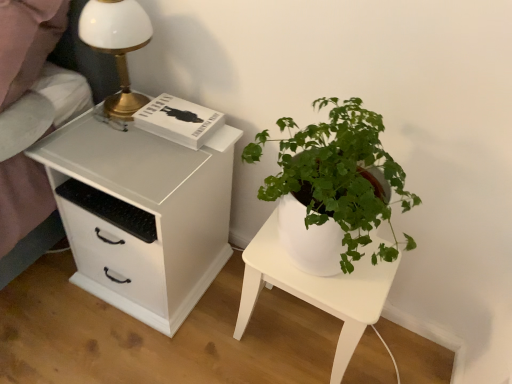
Image resolution: width=512 pixels, height=384 pixels. What do you see at coordinates (316, 289) in the screenshot?
I see `white glossy nightstand at lower right` at bounding box center [316, 289].

Where is `white matte chest of drawers at left`? The image size is (512, 384). white matte chest of drawers at left is located at coordinates pyautogui.click(x=142, y=214).

Between white matte chest of drawers at left and white glossy table lamp at upper left, which one appears on the left side from the viewer's perspective?

From the viewer's perspective, white glossy table lamp at upper left appears more on the left side.

From a real-world perspective, is white matte chest of drawers at left on top of white glossy table lamp at upper left?

No.

Does white matte chest of drawers at left have a greater height compared to white glossy table lamp at upper left?

Yes.

Considering the relative sizes of white matte chest of drawers at left and white glossy table lamp at upper left in the image provided, is white matte chest of drawers at left bigger than white glossy table lamp at upper left?

Yes.

Considering their positions, is white glossy table lamp at upper left located in front of or behind white matte chest of drawers at left?

In the image, white glossy table lamp at upper left appears behind white matte chest of drawers at left.

Considering the positions of objects white glossy table lamp at upper left and white matte chest of drawers at left in the image provided, who is more to the right, white glossy table lamp at upper left or white matte chest of drawers at left?

Positioned to the right is white matte chest of drawers at left.

Is white glossy table lamp at upper left outside of white matte chest of drawers at left?

white glossy table lamp at upper left lies outside white matte chest of drawers at left's area.

Which is further, (97, 39) or (57, 170)?

Positioned behind is point (57, 170).

From a real-world perspective, is white glossy table lamp at upper left over white glossy nightstand at lower right?

Correct, in the physical world, white glossy table lamp at upper left is higher than white glossy nightstand at lower right.

Is white glossy table lamp at upper left facing towards white glossy nightstand at lower right?

No, white glossy table lamp at upper left is not aimed at white glossy nightstand at lower right.

From the image's perspective, which object appears higher, white glossy table lamp at upper left or white glossy nightstand at lower right?

white glossy table lamp at upper left appears higher in the image.

Does white glossy table lamp at upper left have a larger size compared to white glossy nightstand at lower right?

No.

Measure the distance between white glossy nightstand at lower right and white glossy table lamp at upper left.

They are 27.82 inches apart.

In the scene shown: Considering their positions, is white glossy nightstand at lower right located in front of or behind white glossy table lamp at upper left?

Visually, white glossy nightstand at lower right is located behind white glossy table lamp at upper left.

Is white glossy nightstand at lower right next to white glossy table lamp at upper left?

No, white glossy nightstand at lower right is not with white glossy table lamp at upper left.

Which is in front, point (352, 351) or point (106, 30)?

The point (106, 30) is closer to the camera.

Can you confirm if white glossy nightstand at lower right is smaller than white matte chest of drawers at left?

Indeed, white glossy nightstand at lower right has a smaller size compared to white matte chest of drawers at left.

Would you say white glossy nightstand at lower right is to the left or to the right of white matte chest of drawers at left in the picture?

Based on their positions, white glossy nightstand at lower right is located to the right of white matte chest of drawers at left.

In the scene shown: Are white glossy nightstand at lower right and white matte chest of drawers at left located far from each other?

No, white glossy nightstand at lower right is not far away from white matte chest of drawers at left.

Consider the image. Is white glossy nightstand at lower right facing towards white matte chest of drawers at left?

No.

Is white matte chest of drawers at left positioned with its back to white glossy nightstand at lower right?

white matte chest of drawers at left is not turned away from white glossy nightstand at lower right.

What's the angular difference between white matte chest of drawers at left and white glossy nightstand at lower right's facing directions?

white matte chest of drawers at left and white glossy nightstand at lower right are facing 2.68 degrees away from each other.

Does point (167, 321) lie behind point (358, 270)?

Yes, point (167, 321) is farther from viewer.

Considering the relative sizes of white matte chest of drawers at left and white glossy nightstand at lower right in the image provided, is white matte chest of drawers at left thinner than white glossy nightstand at lower right?

Incorrect, the width of white matte chest of drawers at left is not less than that of white glossy nightstand at lower right.

At what (x,y) coordinates should I click in order to perform the action: click on the chest of drawers that is in front of the white glossy table lamp at upper left. Please return your answer as a coordinate pair (x, y). The image size is (512, 384). Looking at the image, I should click on (142, 214).

Identify the location of chest of drawers below the white glossy table lamp at upper left (from the image's perspective). Image resolution: width=512 pixels, height=384 pixels. (142, 214).

Based on their spatial positions, is white matte chest of drawers at left or white glossy nightstand at lower right closer to white glossy table lamp at upper left?

white matte chest of drawers at left lies closer to white glossy table lamp at upper left than the other object.

From the image, which object appears to be farther from white glossy table lamp at upper left, white glossy nightstand at lower right or white matte chest of drawers at left?

white glossy nightstand at lower right is further to white glossy table lamp at upper left.

Considering their positions, is white glossy table lamp at upper left positioned further to white glossy nightstand at lower right than white matte chest of drawers at left?

Based on the image, white glossy table lamp at upper left appears to be further to white glossy nightstand at lower right.

When comparing their distances from white matte chest of drawers at left, does white glossy nightstand at lower right or white glossy table lamp at upper left seem closer?

The object closer to white matte chest of drawers at left is white glossy table lamp at upper left.

From the image, which object appears to be nearer to white matte chest of drawers at left, white glossy table lamp at upper left or white glossy nightstand at lower right?

Based on the image, white glossy table lamp at upper left appears to be nearer to white matte chest of drawers at left.

Which object lies nearer to the anchor point white glossy nightstand at lower right, white matte chest of drawers at left or white glossy table lamp at upper left?

Based on the image, white matte chest of drawers at left appears to be nearer to white glossy nightstand at lower right.

I want to click on the chest of drawers that lies between white glossy table lamp at upper left and white glossy nightstand at lower right from top to bottom, so click(142, 214).